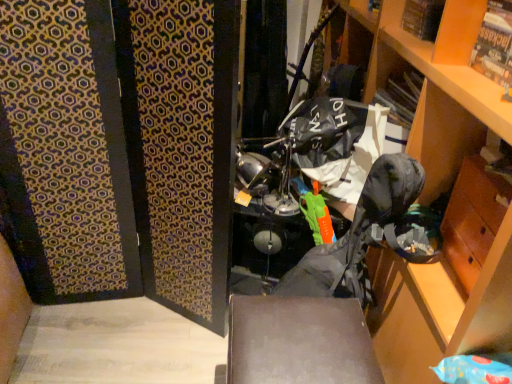
Question: Is matte cardboard magazine at upper right a part of wooden drawer at lower right?

Choices:
 (A) no
 (B) yes

Answer: (A)

Question: Can you confirm if wooden drawer at lower right is taller than matte cardboard magazine at upper right?

Choices:
 (A) yes
 (B) no

Answer: (A)

Question: Does wooden drawer at lower right have a lesser width compared to matte cardboard magazine at upper right?

Choices:
 (A) no
 (B) yes

Answer: (A)

Question: From a real-world perspective, is wooden drawer at lower right over matte cardboard magazine at upper right?

Choices:
 (A) yes
 (B) no

Answer: (B)

Question: Is matte cardboard magazine at upper right at the back of wooden drawer at lower right?

Choices:
 (A) yes
 (B) no

Answer: (B)

Question: Is wooden drawer at lower right bigger than matte cardboard magazine at upper right?

Choices:
 (A) no
 (B) yes

Answer: (B)

Question: Could you tell me if wooden cabinet at right is turned towards camouflage fabric folding chair at center?

Choices:
 (A) no
 (B) yes

Answer: (B)

Question: From a real-world perspective, is wooden cabinet at right located beneath camouflage fabric folding chair at center?

Choices:
 (A) yes
 (B) no

Answer: (B)

Question: From the image's perspective, is wooden cabinet at right beneath camouflage fabric folding chair at center?

Choices:
 (A) yes
 (B) no

Answer: (B)

Question: Is wooden cabinet at right looking in the opposite direction of camouflage fabric folding chair at center?

Choices:
 (A) no
 (B) yes

Answer: (B)

Question: Can you confirm if wooden cabinet at right is taller than camouflage fabric folding chair at center?

Choices:
 (A) yes
 (B) no

Answer: (A)

Question: Considering the relative positions of wooden cabinet at right and camouflage fabric folding chair at center in the image provided, is wooden cabinet at right to the left of camouflage fabric folding chair at center from the viewer's perspective?

Choices:
 (A) no
 (B) yes

Answer: (A)

Question: Is camouflage fabric folding chair at center completely or partially outside of wooden cabinet at right?

Choices:
 (A) no
 (B) yes

Answer: (B)